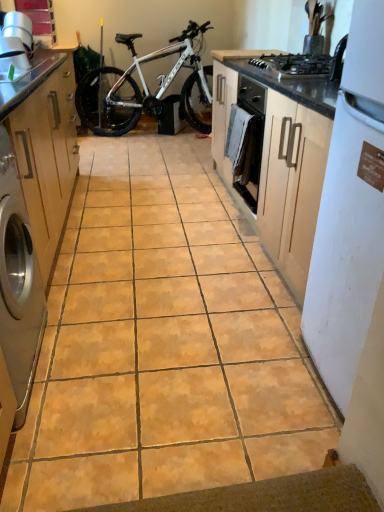
Locate an element on the screen. Image resolution: width=384 pixels, height=512 pixels. free space that is in between white matte refrigerator at right and satin silver washing machine at left is located at coordinates (173, 372).